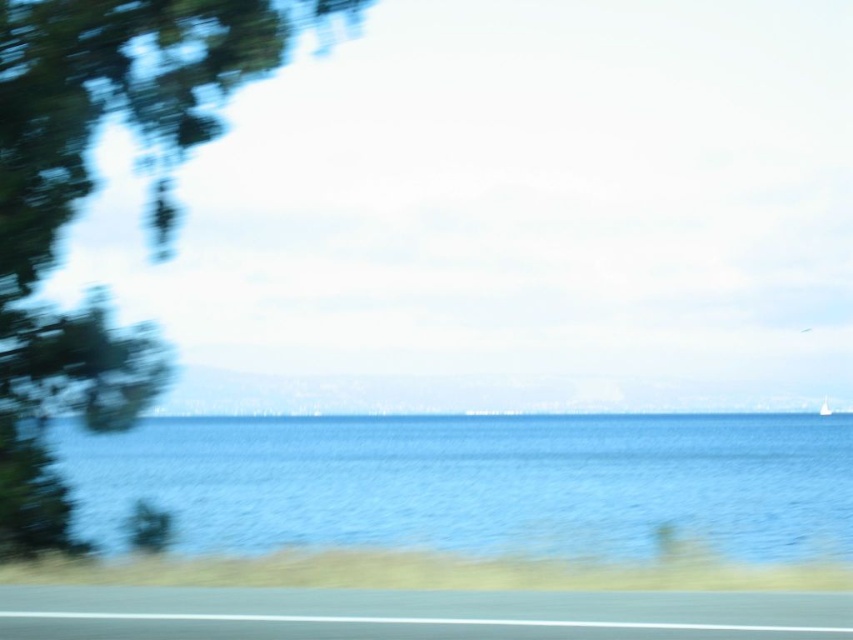
Is point (7, 348) farther from viewer compared to point (457, 593)?

Yes, point (7, 348) is farther from viewer.

Between green matte tree at left and smooth asphalt highway at lower center, which one has less height?

Standing shorter between the two is smooth asphalt highway at lower center.

Is point (59, 497) positioned before point (537, 604)?

No, it is not.

Locate an element on the screen. This screenshot has height=640, width=853. green matte tree at left is located at coordinates (84, 196).

Is blue water at center closer to camera compared to green matte tree at left?

Yes, it is in front of green matte tree at left.

Is blue water at center further to the viewer compared to green matte tree at left?

That is False.

Is point (503, 422) farther from camera compared to point (53, 360)?

Yes, it is.

At what (x,y) coordinates should I click in order to perform the action: click on blue water at center. Please return your answer as a coordinate pair (x, y). Looking at the image, I should click on (473, 483).

Does blue water at center appear under smooth asphalt highway at lower center?

Yes.

Find the location of `blue water at center`. blue water at center is located at coordinates (473, 483).

Identify the location of blue water at center. (473, 483).